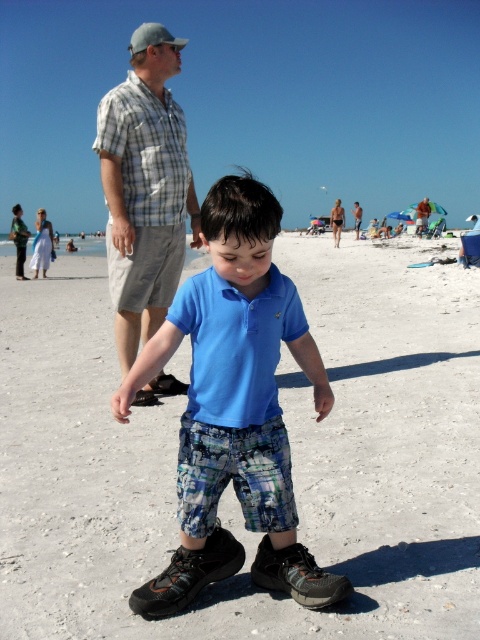
Question: Can you confirm if plaid shirt at center is thinner than light brown plaid shirt at center?

Choices:
 (A) no
 (B) yes

Answer: (B)

Question: Which point is farther from the camera taking this photo?

Choices:
 (A) (356, 211)
 (B) (288, 500)

Answer: (A)

Question: Is plaid shirt at center smaller than printed cotton shorts at center?

Choices:
 (A) yes
 (B) no

Answer: (A)

Question: Which object appears farthest from the camera in this image?

Choices:
 (A) plaid shirt at center
 (B) light brown plaid shirt at center
 (C) plaid cotton shirt at upper left
 (D) blue cotton shirt at center

Answer: (B)

Question: Which object appears farthest from the camera in this image?

Choices:
 (A) light brown plaid shirt at center
 (B) plaid shirt at center
 (C) beige plaid shirt at center

Answer: (C)

Question: Is blue cotton shirt at center above gray fabric baseball cap at upper left?

Choices:
 (A) no
 (B) yes

Answer: (A)